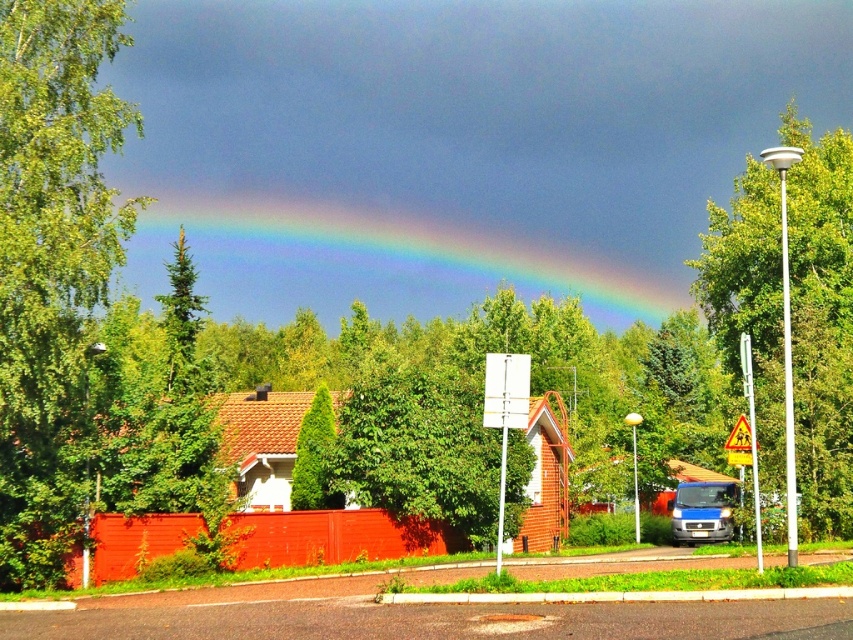
You are standing on the paved road in the foreground and want to take a photo of the rainbow at upper center. To frame the rainbow properly, where should you position your camera relative to the road?

The rainbow at upper center is located at coordinates approximately 0.402 on the horizontal axis and 0.478 on the vertical axis. Therefore, you should position your camera slightly to the right of the road center horizontally and about halfway up the frame vertically to capture the rainbow at upper center.

You are standing at point (314,456) on the paved road. Looking around, you see a green textured tree at center. Which direction should you walk to get closer to the green textured tree at center?

Since you are already at the point where the green textured tree at center is located, you don not need to move. You are already at the location of the green textured tree at center.